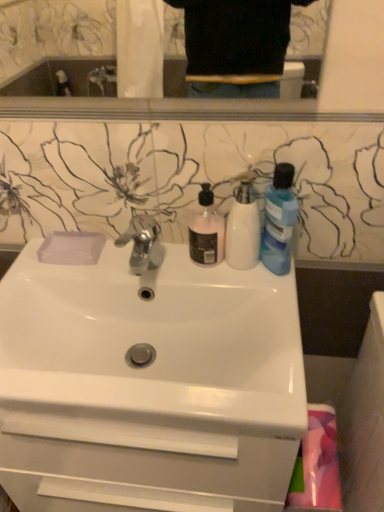
Locate an element on the screen. Image resolution: width=384 pixels, height=512 pixels. free spot to the left of transparent plastic soap at upper left is located at coordinates (30, 257).